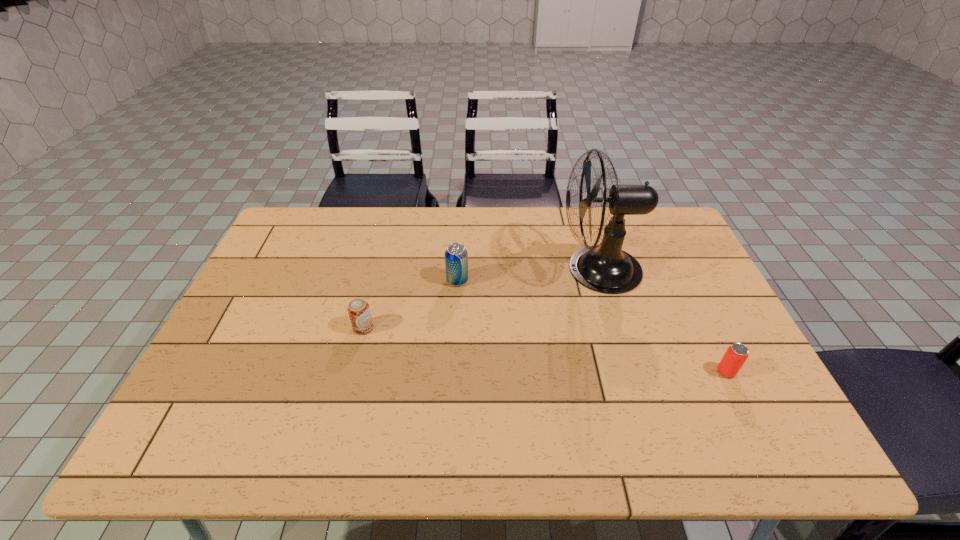
Locate an element on the screen. vacant space situated on the front-facing side of the third object from left to right is located at coordinates (467, 269).

The image size is (960, 540). I want to click on vacant space located 0.210m on the right of the tallest beer can, so click(539, 280).

This screenshot has width=960, height=540. What are the coordinates of `free spot located 0.230m on the right of the leftmost beer can` in the screenshot? It's located at (459, 328).

At what (x,y) coordinates should I click in order to perform the action: click on vacant space situated 0.200m on the left of the rightmost beer can. Please return your answer as a coordinate pair (x, y). This screenshot has height=540, width=960. Looking at the image, I should click on (636, 372).

The height and width of the screenshot is (540, 960). In order to click on object that is at the far edge in this screenshot , I will do `click(605, 268)`.

Image resolution: width=960 pixels, height=540 pixels. In order to click on object positioned at the right edge in this screenshot , I will do `click(737, 353)`.

In the image, there is a desktop. Identify the location of vacant space at the far edge. The image size is (960, 540). (568, 212).

Identify the location of vacant space at the left edge of the desktop. The height and width of the screenshot is (540, 960). [228, 357].

In the image, there is a desktop. Where is `vacant space at the right edge`? vacant space at the right edge is located at coordinates [708, 387].

The height and width of the screenshot is (540, 960). In the image, there is a desktop. What are the coordinates of `vacant space at the near left corner` in the screenshot? It's located at (187, 446).